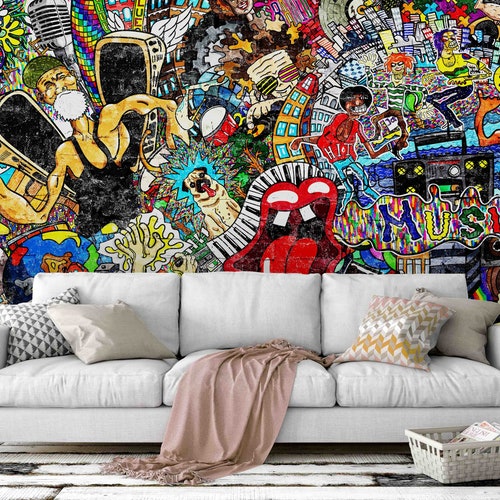
Where is `basket`? The width and height of the screenshot is (500, 500). basket is located at coordinates (437, 462).